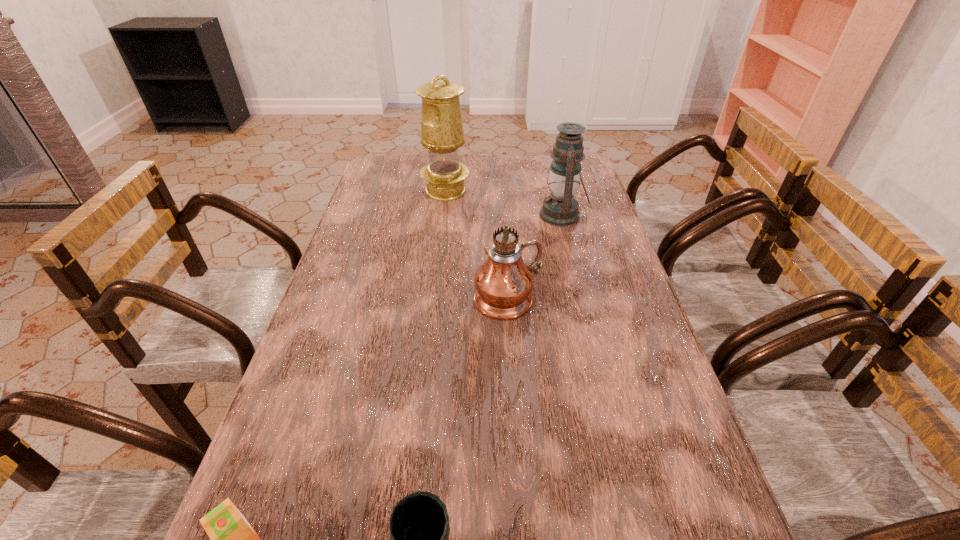
What are the coordinates of `the leftmost oil lamp` in the screenshot? It's located at click(442, 133).

I want to click on the second object from right to left, so click(x=503, y=283).

Where is `the nearest oil lamp`? The height and width of the screenshot is (540, 960). the nearest oil lamp is located at coordinates (503, 283).

Where is `the shortest oil lamp`? the shortest oil lamp is located at coordinates (560, 208).

Locate an element on the screen. the third shortest object is located at coordinates (560, 208).

I want to click on vacant space positioned on the right of the leftmost oil lamp, so click(575, 191).

Identify the location of free region located on the back of the second object from right to left. This screenshot has height=540, width=960. (502, 207).

You are a GUI agent. You are given a task and a screenshot of the screen. Output one action in this format:
    pyautogui.click(x=<x>, y=<y>)
    Task: Click on the blank space located 0.120m on the left of the third tallest object
    The width and height of the screenshot is (960, 540).
    Given the screenshot: What is the action you would take?
    pyautogui.click(x=502, y=215)

The height and width of the screenshot is (540, 960). In order to click on object that is positioned at the far edge in this screenshot , I will do `click(442, 133)`.

The width and height of the screenshot is (960, 540). In order to click on object that is at the right edge in this screenshot , I will do `click(560, 208)`.